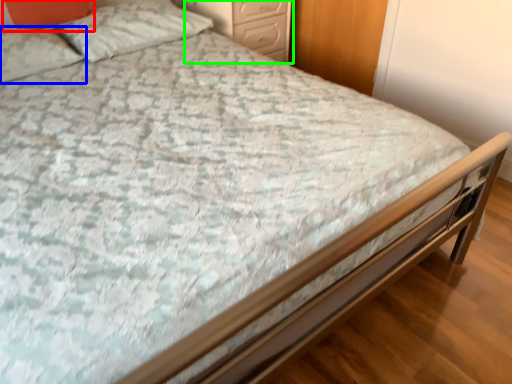
Question: Estimate the real-world distances between objects in this image. Which object is farther from pillow (highlighted by a red box), pillow (highlighted by a blue box) or nightstand (highlighted by a green box)?

Choices:
 (A) pillow
 (B) nightstand

Answer: (B)